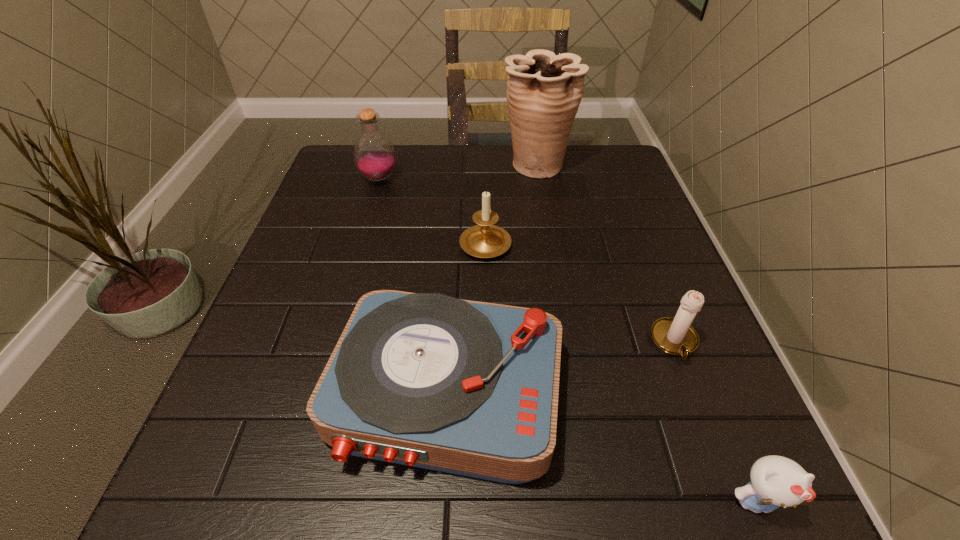
The height and width of the screenshot is (540, 960). Find the location of `free location at the near left corner of the desktop`. free location at the near left corner of the desktop is located at coordinates (x=183, y=521).

Locate an element on the screen. This screenshot has width=960, height=540. blank space at the far right corner of the desktop is located at coordinates (576, 154).

Locate an element on the screen. Image resolution: width=960 pixels, height=540 pixels. vacant space at the near right corner is located at coordinates (711, 517).

This screenshot has width=960, height=540. What are the coordinates of `vacant area that lies between the third farthest object and the kitten` in the screenshot? It's located at (620, 372).

Where is `vacant space that is in between the kitten and the fifth shortest object`? The width and height of the screenshot is (960, 540). vacant space that is in between the kitten and the fifth shortest object is located at coordinates (566, 341).

The width and height of the screenshot is (960, 540). What are the coordinates of `blank region between the kitten and the record player` in the screenshot? It's located at (601, 447).

The image size is (960, 540). What are the coordinates of `vacant area that lies between the fourth nearest object and the kitten` in the screenshot? It's located at (620, 372).

You are a GUI agent. You are given a task and a screenshot of the screen. Output one action in this format:
    pyautogui.click(x=<x>, y=<y>)
    Task: Click on the vacant area that lies between the nearer candle holder and the fifth shortest object
    This screenshot has height=540, width=960.
    Given the screenshot: What is the action you would take?
    pyautogui.click(x=527, y=261)

Identify the location of free area in between the tallest object and the record player. The height and width of the screenshot is (540, 960). (492, 278).

Image resolution: width=960 pixels, height=540 pixels. Find the location of `free spot between the kitten and the nearer candle holder`. free spot between the kitten and the nearer candle holder is located at coordinates (714, 422).